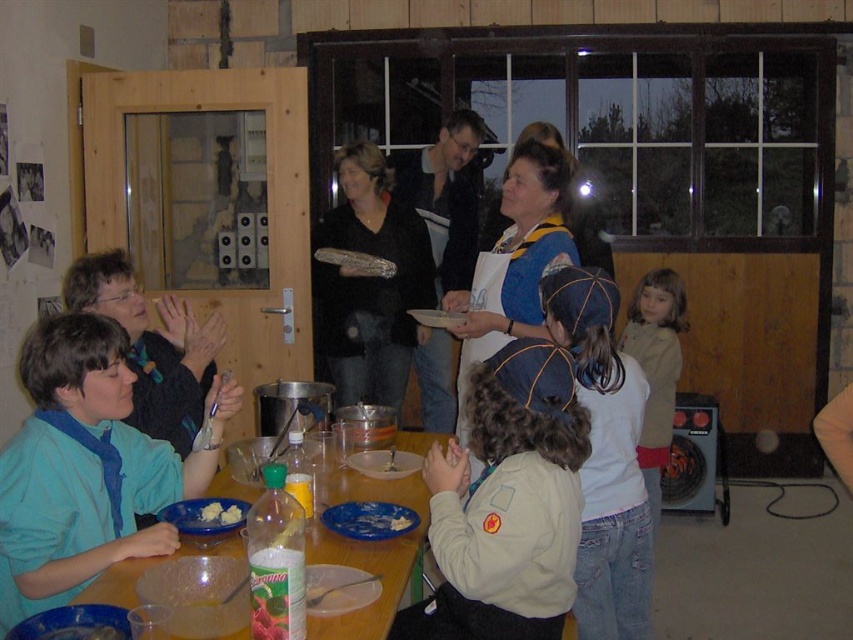
Question: Which object is positioned closest to the white creamy food at center?

Choices:
 (A) blue plastic plate at center
 (B) blue fabric shirt at left
 (C) matte black apron at center

Answer: (A)

Question: Which is farther from the blue fabric apron at center?

Choices:
 (A) blue fabric shirt at left
 (B) blue plastic plate at center

Answer: (A)

Question: Does wooden table at center have a larger size compared to matte black apron at center?

Choices:
 (A) no
 (B) yes

Answer: (A)

Question: Which of the following is the farthest from the observer?

Choices:
 (A) khaki uniform at center
 (B) blue fabric apron at center

Answer: (B)

Question: Is matte black sweater at center smaller than light brown hair at right?

Choices:
 (A) no
 (B) yes

Answer: (A)

Question: Is matte black sweater at center positioned behind blue fabric apron at center?

Choices:
 (A) yes
 (B) no

Answer: (A)